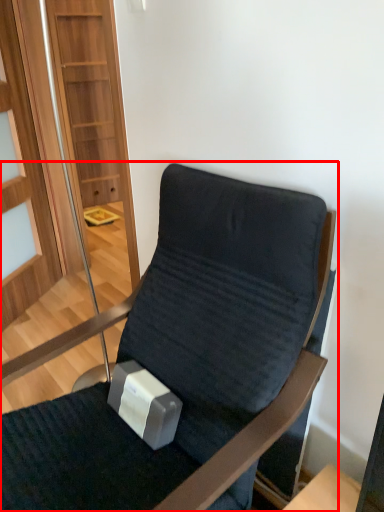
Question: From the image's perspective, what is the correct spatial relationship of chair (annotated by the red box) in relation to glass door?

Choices:
 (A) above
 (B) below

Answer: (B)